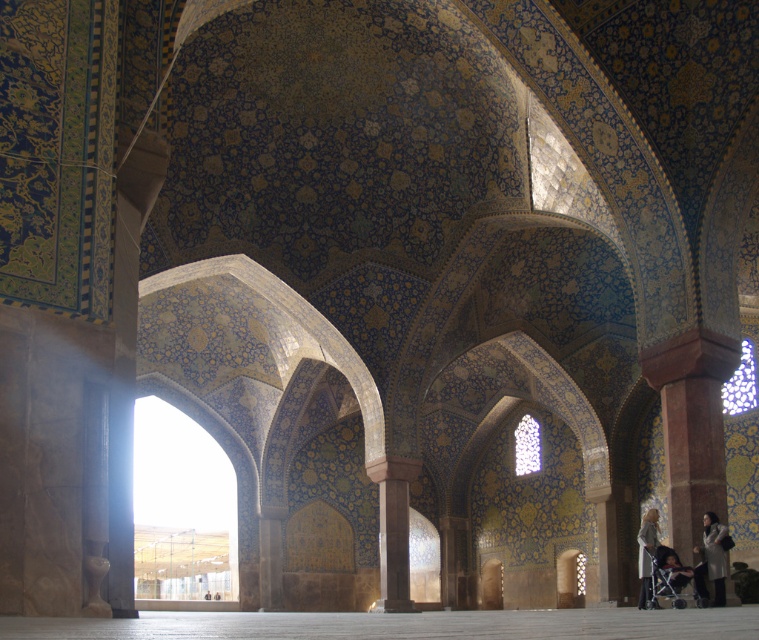
Is brown stone column at center to the left of metallic silver baby carriage at lower right from the viewer's perspective?

Indeed, brown stone column at center is positioned on the left side of metallic silver baby carriage at lower right.

Can you confirm if brown stone column at center is shorter than metallic silver baby carriage at lower right?

No.

Is point (400, 580) closer to viewer compared to point (668, 557)?

No, it is not.

What are the coordinates of `brown stone column at center` in the screenshot? It's located at (392, 529).

Does brown stone column at center appear on the left side of silver metallic coat at lower right?

Correct, you'll find brown stone column at center to the left of silver metallic coat at lower right.

Looking at this image, which of these two, brown stone column at center or silver metallic coat at lower right, stands shorter?

Standing shorter between the two is silver metallic coat at lower right.

Where is `brown stone column at center`? Image resolution: width=759 pixels, height=640 pixels. brown stone column at center is located at coordinates (392, 529).

Between silver metallic coat at lower right and metallic silver baby carriage at lower right, which one appears on the right side from the viewer's perspective?

From the viewer's perspective, silver metallic coat at lower right appears more on the right side.

Is silver metallic coat at lower right positioned behind metallic silver baby carriage at lower right?

No, silver metallic coat at lower right is in front of metallic silver baby carriage at lower right.

The image size is (759, 640). What do you see at coordinates (710, 557) in the screenshot?
I see `silver metallic coat at lower right` at bounding box center [710, 557].

Identify the location of silver metallic coat at lower right. This screenshot has height=640, width=759. (710, 557).